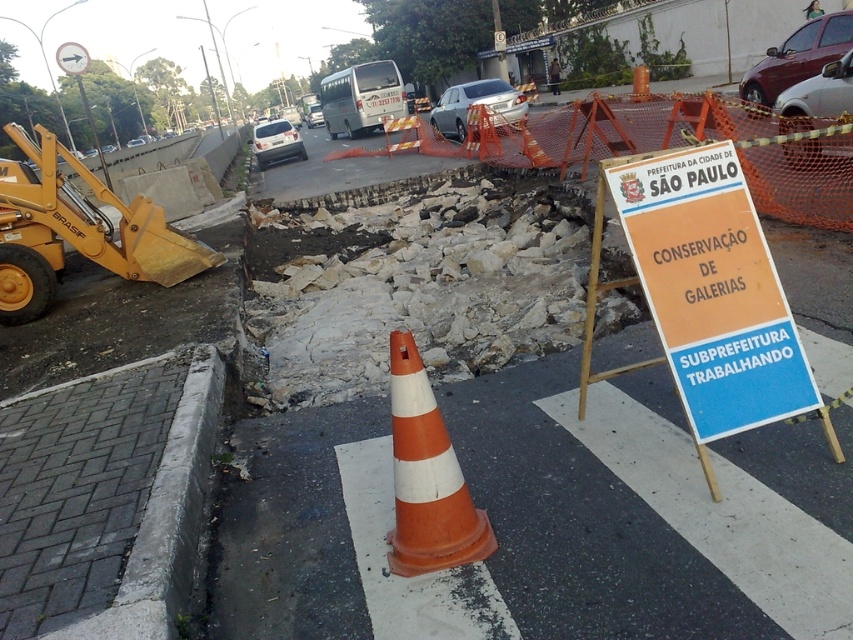
Is yellow metallic excavator at left below orange/white striped traffic cone at center?

No.

Who is higher up, yellow metallic excavator at left or orange/white striped traffic cone at center?

yellow metallic excavator at left is higher up.

Is point (45, 144) closer to camera compared to point (424, 525)?

No.

This screenshot has width=853, height=640. What are the coordinates of `yellow metallic excavator at left` in the screenshot? It's located at (77, 230).

Does orange cardboard sign at center right appear on the right side of orange/white striped traffic cone at center?

Indeed, orange cardboard sign at center right is positioned on the right side of orange/white striped traffic cone at center.

Which is behind, point (717, 237) or point (432, 524)?

The point (717, 237) is more distant.

In order to click on orange cardboard sign at center right in this screenshot , I will do `click(705, 292)`.

In the scene shown: Can you confirm if orange cardboard sign at center right is positioned to the right of yellow metallic excavator at left?

Indeed, orange cardboard sign at center right is positioned on the right side of yellow metallic excavator at left.

Does orange cardboard sign at center right have a greater height compared to yellow metallic excavator at left?

Indeed, orange cardboard sign at center right has a greater height compared to yellow metallic excavator at left.

Who is more forward, (698, 376) or (91, 204)?

Point (698, 376) is more forward.

Where is `orange cardboard sign at center right`? This screenshot has width=853, height=640. orange cardboard sign at center right is located at coordinates (705, 292).